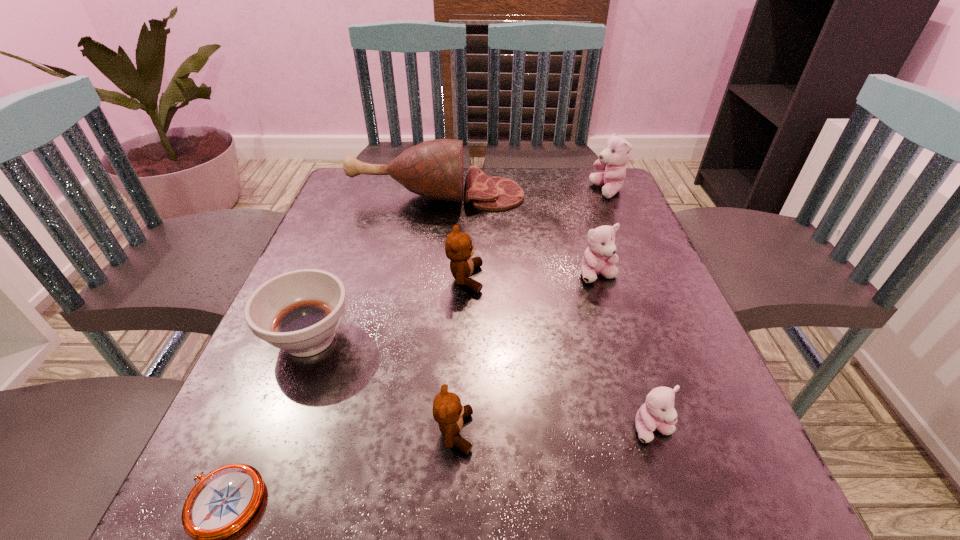
Identify the location of ham. (433, 169).

The width and height of the screenshot is (960, 540). Identify the location of the rightmost teddy bear. (616, 154).

Identify the location of the rightmost pink teddy bear. (616, 154).

Find the location of `the bigger brown teddy bear`. the bigger brown teddy bear is located at coordinates (458, 247).

Identify the location of the second biggest pink teddy bear. The width and height of the screenshot is (960, 540). [599, 256].

This screenshot has width=960, height=540. I want to click on the fourth nearest object, so click(299, 311).

I want to click on the smaller brown teddy bear, so click(448, 412).

I want to click on the nearest pink teddy bear, so click(658, 412).

Where is `vacant region located 0.190m at the sliced end of the ham`? This screenshot has height=540, width=960. vacant region located 0.190m at the sliced end of the ham is located at coordinates (595, 195).

Locate an element on the screen. The width and height of the screenshot is (960, 540). free space located at the face of the rightmost teddy bear is located at coordinates (535, 191).